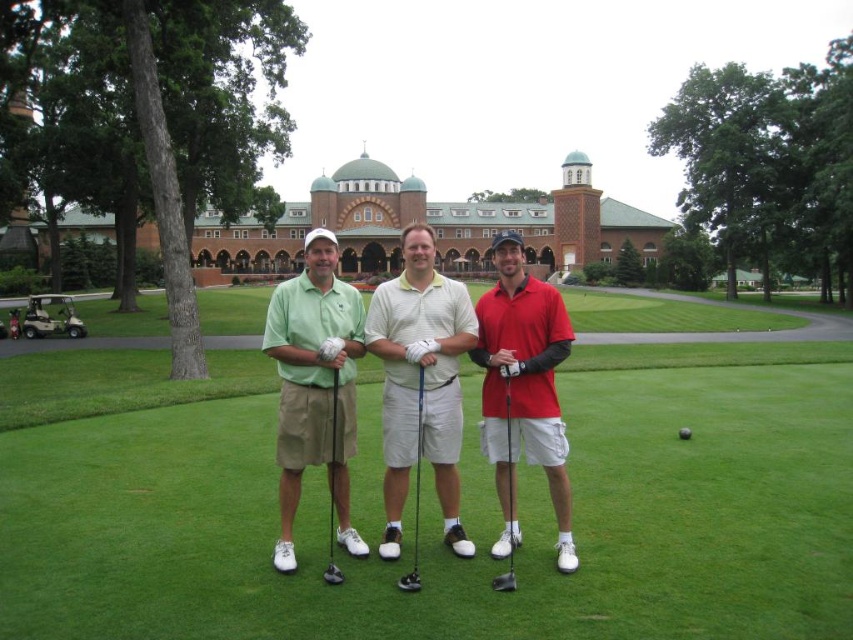
You are a photographer trying to capture a wide shot of the three golfers. Given that the green grass at center takes up more space than the white cotton polo shirt at center, which object should you focus on to ensure the entire group is framed properly?

Since the green grass at center is wider than the white cotton polo shirt at center, you should focus on the green grass at center to ensure the entire group is framed properly as it occupies more space in the scene.

You are a photographer standing at the center of the golf course. You want to take a photo of the white cotton polo shirt at center. Where should you aim your camera to capture it?

You should aim your camera at the point with coordinates (418, 381) to capture the white cotton polo shirt at center.

You are a photographer trying to capture a clear shot of the matte red polo shirt at center and the metallic silver golf club at center. Since you want to focus on the shirt, which object should you adjust your camera lens to focus on first?

The matte red polo shirt at center is taller than the metallic silver golf club at center, so you should focus on the matte red polo shirt at center first as it is larger in the frame.